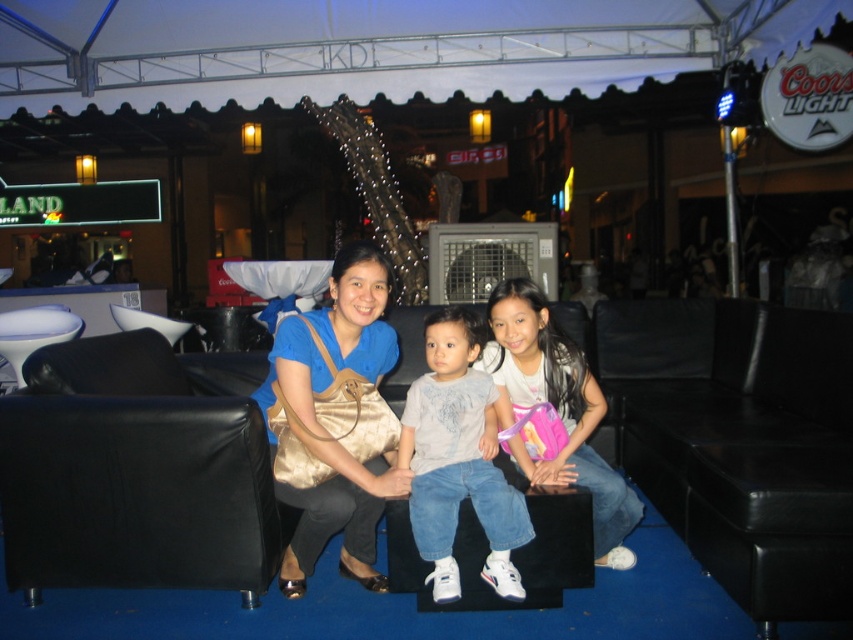
Based on the photo, can you confirm if black leather couch at center is positioned above pink fabric backpack at center?

Actually, black leather couch at center is below pink fabric backpack at center.

Looking at this image, does black leather couch at center lie in front of pink fabric backpack at center?

Yes, it is in front of pink fabric backpack at center.

Which is behind, point (224, 435) or point (531, 394)?

Positioned behind is point (531, 394).

You are a GUI agent. You are given a task and a screenshot of the screen. Output one action in this format:
    pyautogui.click(x=<x>, y=<y>)
    Task: Click on the black leather couch at center
    The height and width of the screenshot is (640, 853).
    Given the screenshot: What is the action you would take?
    (132, 490)

Can you confirm if black leather couch at lower right is positioned below gold satin purse at center?

No, black leather couch at lower right is not below gold satin purse at center.

Does black leather couch at lower right come behind gold satin purse at center?

No.

Is point (752, 352) positioned before point (339, 392)?

No, (752, 352) is behind (339, 392).

In order to click on black leather couch at lower right in this screenshot , I will do coord(756,460).

Between point (318, 372) and point (498, 422), which one is positioned in front?

Positioned in front is point (318, 372).

From the picture: Between gold satin purse at center and pink fabric backpack at center, which one is positioned lower?

pink fabric backpack at center is lower down.

Is point (367, 531) positioned after point (532, 305)?

No, it is not.

Locate an element on the screen. The image size is (853, 640). gold satin purse at center is located at coordinates (334, 417).